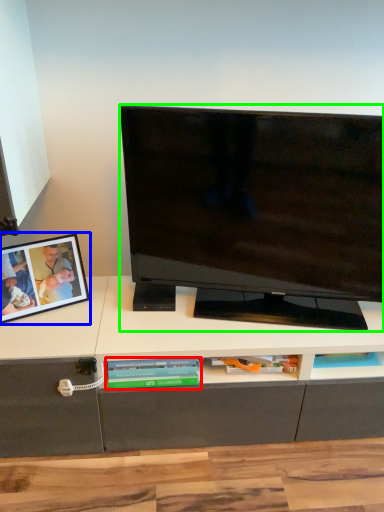
Question: Which object is the farthest from book (highlighted by a red box)? Choose among these: picture frame (highlighted by a blue box) or television (highlighted by a green box).

Choices:
 (A) picture frame
 (B) television

Answer: (B)